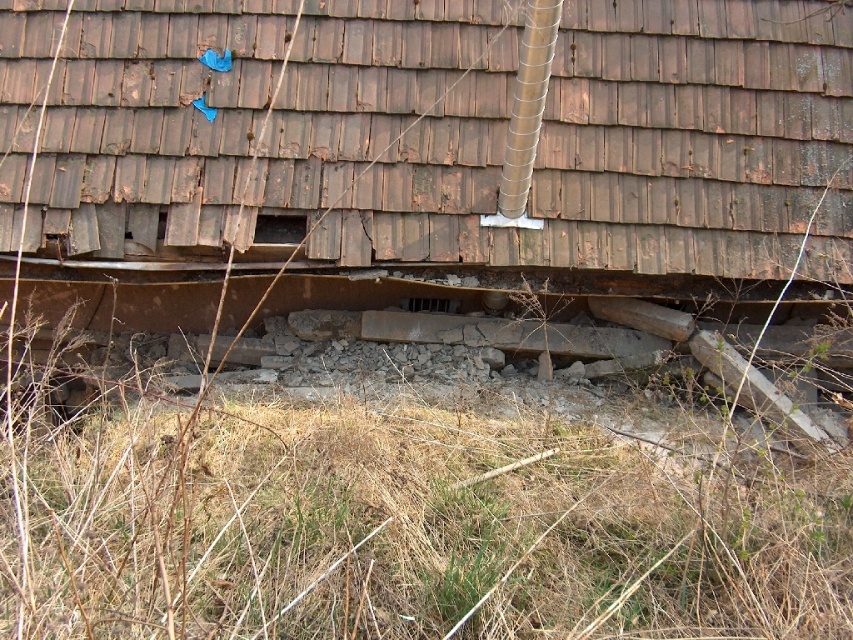
You are a construction worker assessing the roof damage. You see the weathered wood shingles at center and the brown dry grass at lower center. Which object is narrower? Please answer based on their widths.

The weathered wood shingles at center has a lesser width compared to brown dry grass at lower center, so the weathered wood shingles at center is narrower.